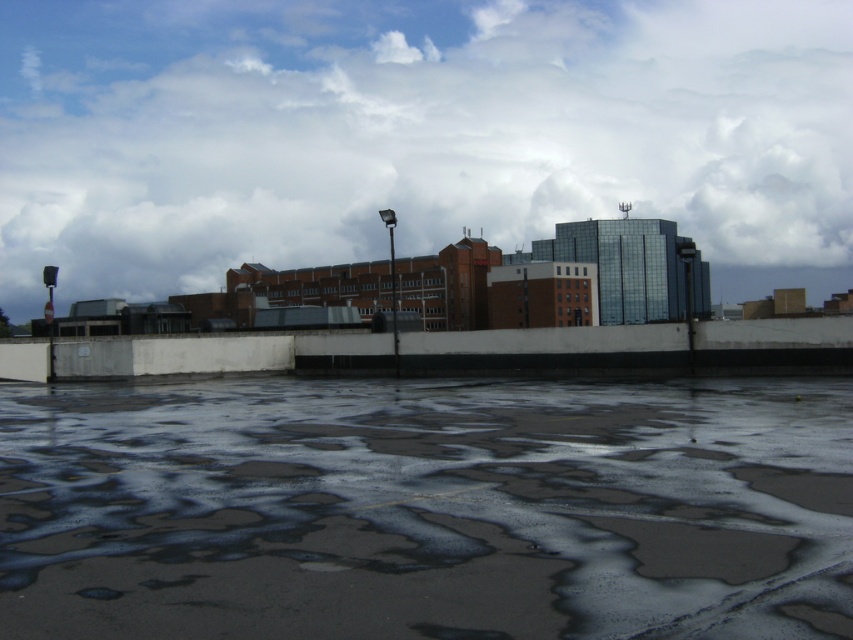
You are standing in the urban landscape and want to take a photo of the white fluffy cloud at upper center without the dark concrete flood at lower center blocking the view. Is it possible?

The dark concrete flood at lower center is behind the white fluffy cloud at upper center, so it won not block the view. You can take the photo without any obstruction.

You are an architect designing a new public plaza. You observe the image and want to incorporate elements similar to the white fluffy cloud at upper center and the dark concrete flood at lower center. Which element should you make larger in your design to match the proportions seen in the image?

The white fluffy cloud at upper center should be made larger than the dark concrete flood at lower center to match the proportions seen in the image.

You are standing in the urban landscape described. There is a point marked at coordinates (415, 134). What object is located at this point?

The point at coordinates (415, 134) marks the location of the white fluffy cloud at upper center.